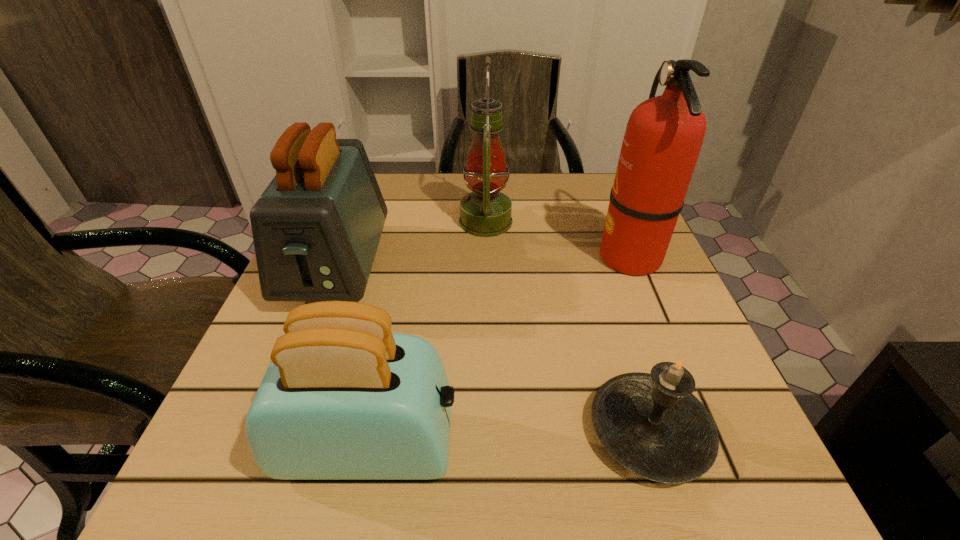
Locate an element on the screen. The width and height of the screenshot is (960, 540). vacant region located on the side of the nearer toaster with the lever is located at coordinates (736, 446).

This screenshot has width=960, height=540. What are the coordinates of `oil lamp present at the far edge` in the screenshot? It's located at (486, 212).

Where is `toaster present at the far edge`? The width and height of the screenshot is (960, 540). toaster present at the far edge is located at coordinates [316, 228].

Locate an element on the screen. The height and width of the screenshot is (540, 960). toaster located in the near edge section of the desktop is located at coordinates [343, 398].

The width and height of the screenshot is (960, 540). I want to click on candle present at the near edge, so click(650, 423).

Identify the location of fire extinguisher that is at the right edge. (663, 138).

At what (x,y) coordinates should I click in order to perform the action: click on candle present at the right edge. Please return your answer as a coordinate pair (x, y). This screenshot has height=540, width=960. Looking at the image, I should click on (650, 423).

You are a GUI agent. You are given a task and a screenshot of the screen. Output one action in this format:
    pyautogui.click(x=<x>, y=<y>)
    Task: Click on the object that is at the far left corner
    The image size is (960, 540).
    Given the screenshot: What is the action you would take?
    pyautogui.click(x=316, y=228)

Where is `object located at the near left corner`? This screenshot has height=540, width=960. object located at the near left corner is located at coordinates (343, 398).

The width and height of the screenshot is (960, 540). Find the location of `object located at the near right corner`. object located at the near right corner is located at coordinates (650, 423).